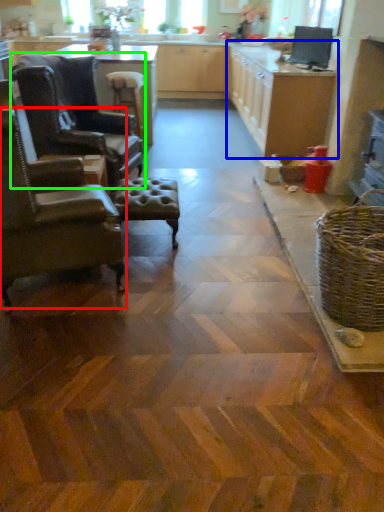
Question: Based on their relative distances, which object is nearer to chair (highlighted by a red box)? Choose from cabinetry (highlighted by a blue box) and chair (highlighted by a green box).

Choices:
 (A) cabinetry
 (B) chair

Answer: (B)